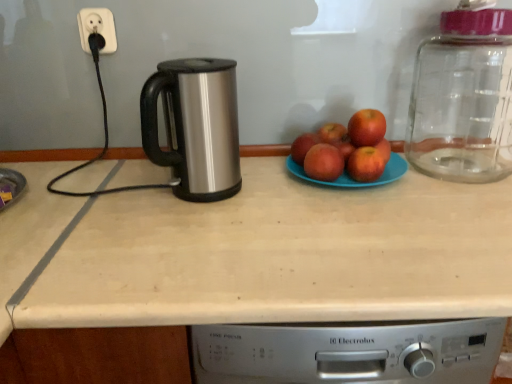
Image resolution: width=512 pixels, height=384 pixels. In order to click on vacant space in front of blue matte plate at center in this screenshot , I will do tap(360, 222).